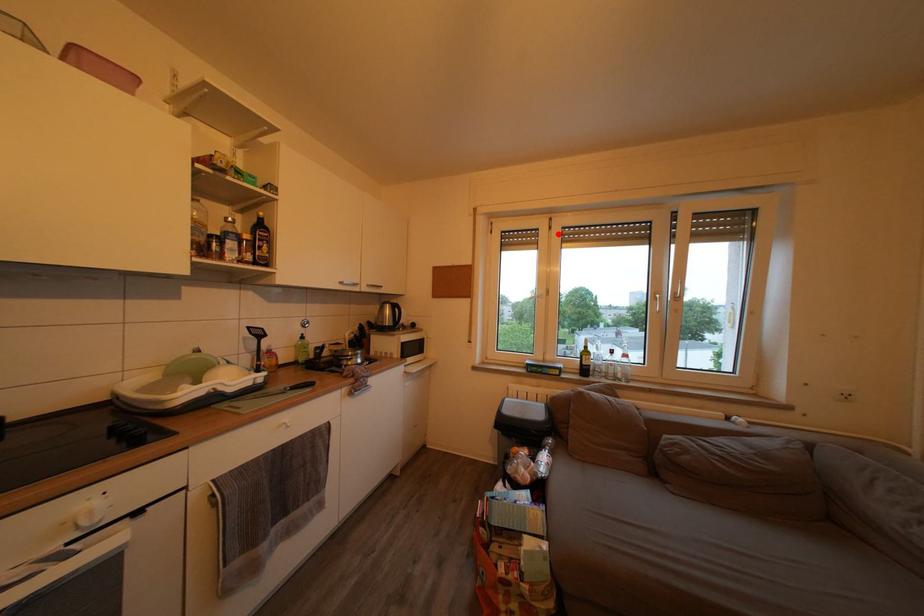
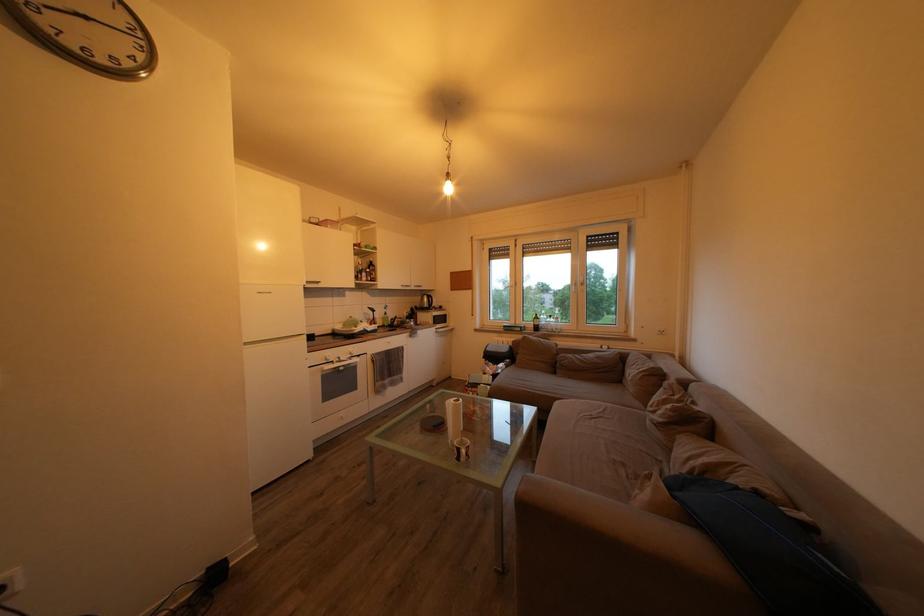
Question: I am providing you with two images of the same scene from different viewpoints. Image1 has a red point marked. In image2, the corresponding 3D location appears at what relative position? Reply with the corresponding letter.

Choices:
 (A) Closer
 (B) Farther

Answer: (A)